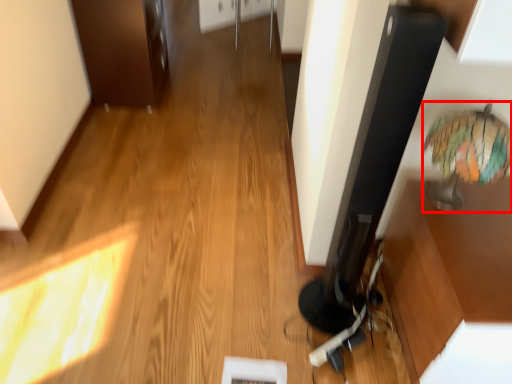
Question: From the image's perspective, what is the correct spatial relationship of table lamp (annotated by the red box) in relation to cabinetry?

Choices:
 (A) below
 (B) above

Answer: (A)